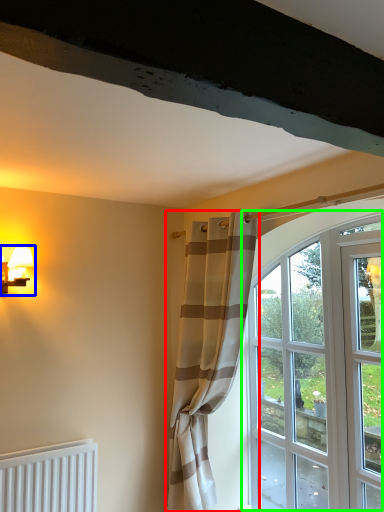
Question: Which is farther away from curtain (highlighted by a red box)? table lamp (highlighted by a blue box) or window (highlighted by a green box)?

Choices:
 (A) table lamp
 (B) window

Answer: (A)